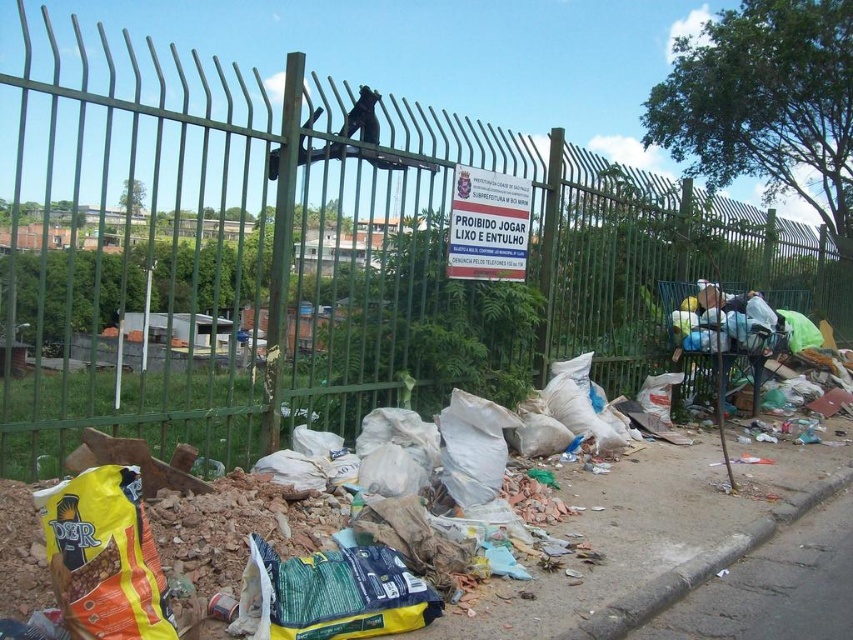
You are a city inspector checking the area for proper waste disposal. You notice the gray concrete pavement at lower right and the dark gray fabric bag at center right. Which object is wider?

The gray concrete pavement at lower right is wider than the dark gray fabric bag at center right.

Based on the photo, you are a city inspector checking the area. You need to determine if the gray concrete pavement at lower right is within the designated inspection zone, which is a rectangle from point A at 0.8, 0.8 to point B at 1.0, 1.0. Is the pavement within this zone?

The gray concrete pavement at lower right is located at point [775,588], which falls within the inspection zone defined by points A at [682,512] and B at [852,639]. Therefore, the pavement is within the zone.

You are a city inspector checking for compliance with the fence sign. You notice the gray concrete pavement at lower right and the dark gray fabric bag at center right. Which object is lower in height?

The gray concrete pavement at lower right has a lesser height compared to the dark gray fabric bag at center right, so the gray concrete pavement at lower right is lower in height.